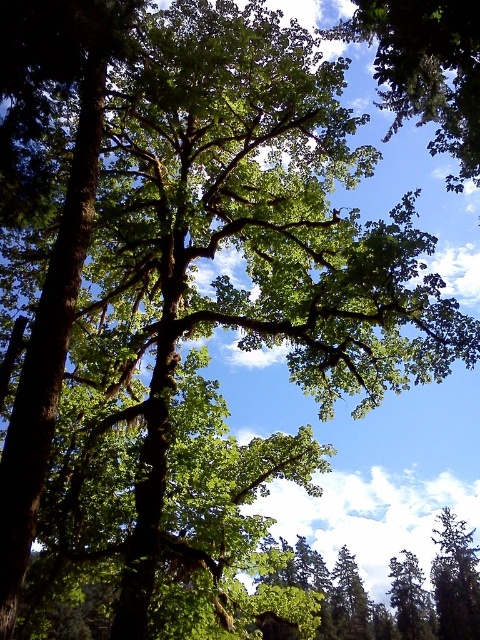
Which is more to the left, green leafy tree at upper center or green leafy tree at lower right?

From the viewer's perspective, green leafy tree at upper center appears more on the left side.

From the picture: Is green leafy tree at upper center further to the viewer compared to green leafy tree at lower right?

No.

Which is in front, point (376, 12) or point (439, 576)?

Point (376, 12) is more forward.

This screenshot has width=480, height=640. Identify the location of green leafy tree at upper center. (425, 68).